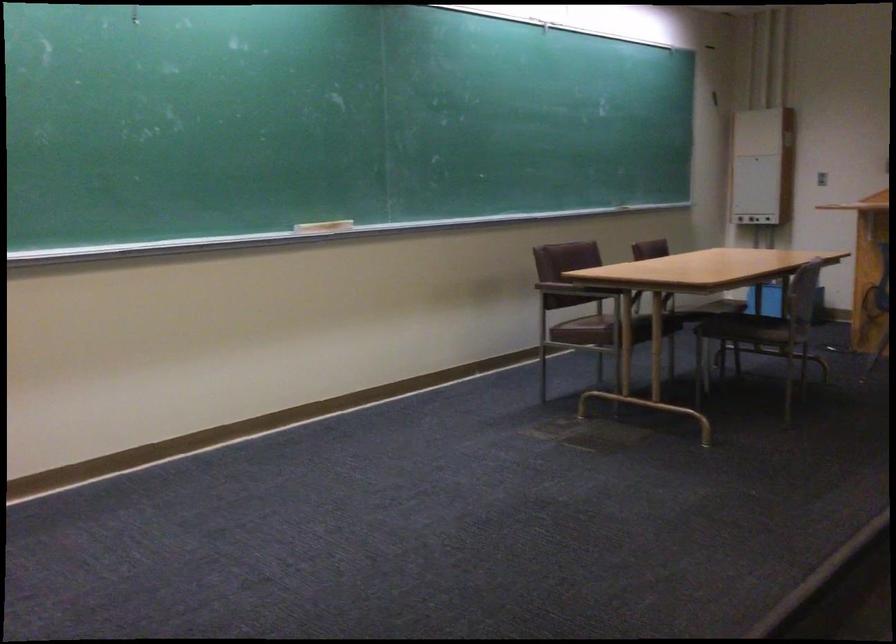
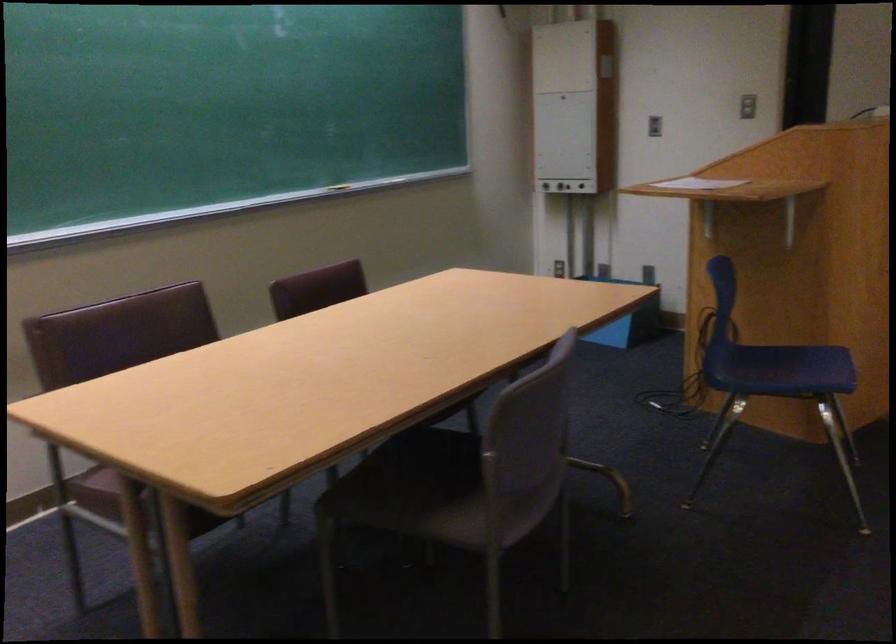
Locate, in the second image, the point that corresponds to (757,323) in the first image.

(454, 487)